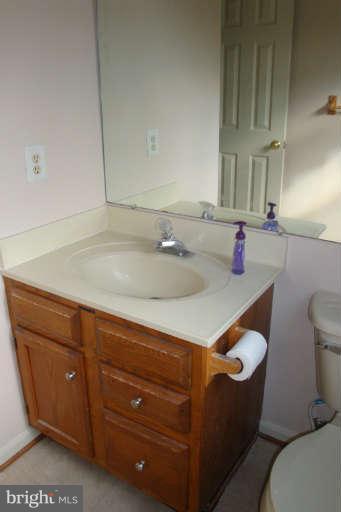
At what (x,y) coordinates should I click in order to perform the action: click on flush handle. Please return your answer as a coordinate pair (x, y). The image size is (341, 512). Looking at the image, I should click on (330, 345).